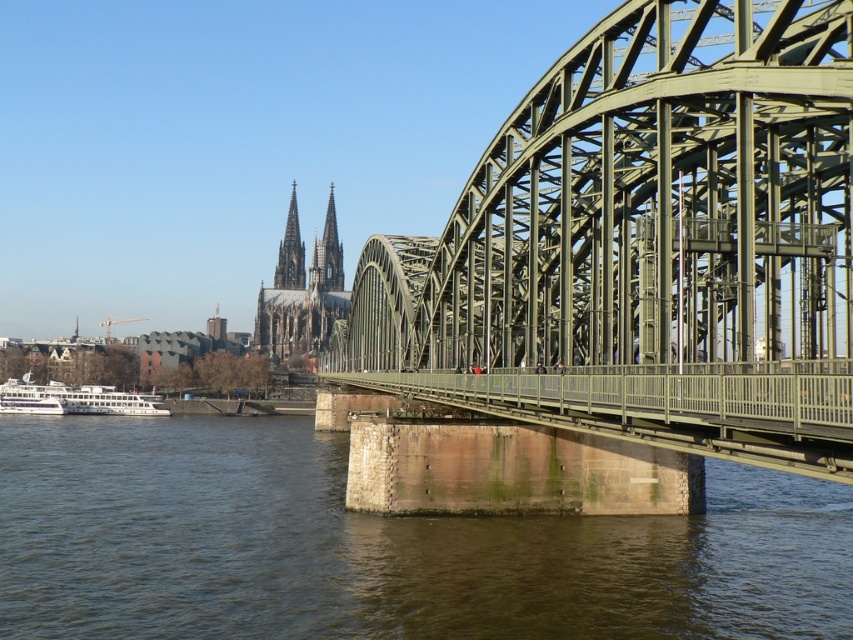
Question: Can you confirm if brown stone river at center is thinner than smooth stone spire at center?

Choices:
 (A) yes
 (B) no

Answer: (B)

Question: Based on their relative distances, which object is farther from the smooth gray stone spire at upper center?

Choices:
 (A) green metallic bridge at center
 (B) green stone cathedral at center
 (C) white matte boat at lower left

Answer: (A)

Question: Is green metallic bridge at center thinner than green stone cathedral at center?

Choices:
 (A) yes
 (B) no

Answer: (B)

Question: Based on their relative distances, which object is nearer to the brown stone river at center?

Choices:
 (A) white matte boat at lower left
 (B) green metallic bridge at center
 (C) green stone cathedral at center

Answer: (B)

Question: Observing the image, what is the correct spatial positioning of green metallic bridge at center in reference to white matte boat at lower left?

Choices:
 (A) above
 (B) below

Answer: (A)

Question: Which of the following is the farthest from the observer?

Choices:
 (A) smooth gray stone spire at upper center
 (B) green metallic bridge at center
 (C) brown stone river at center

Answer: (A)